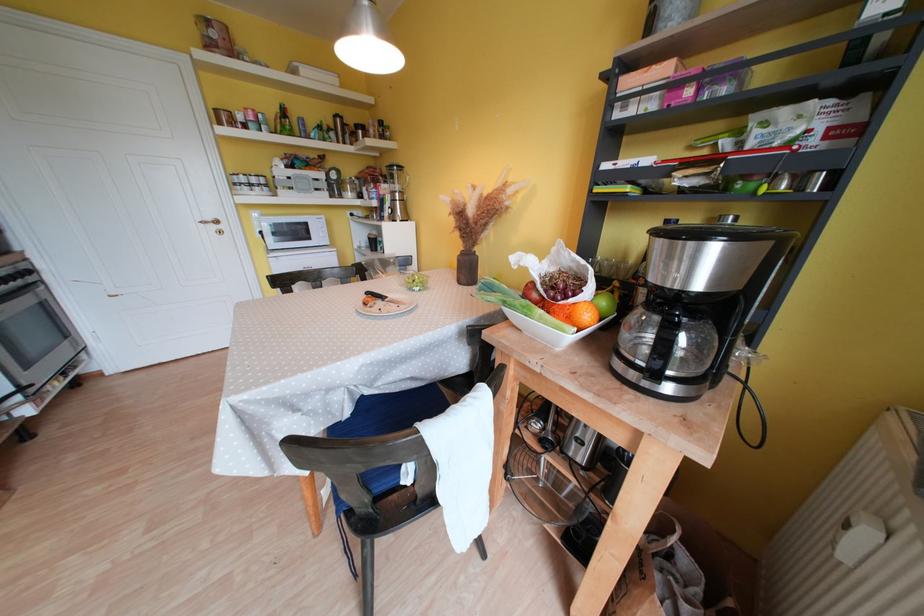
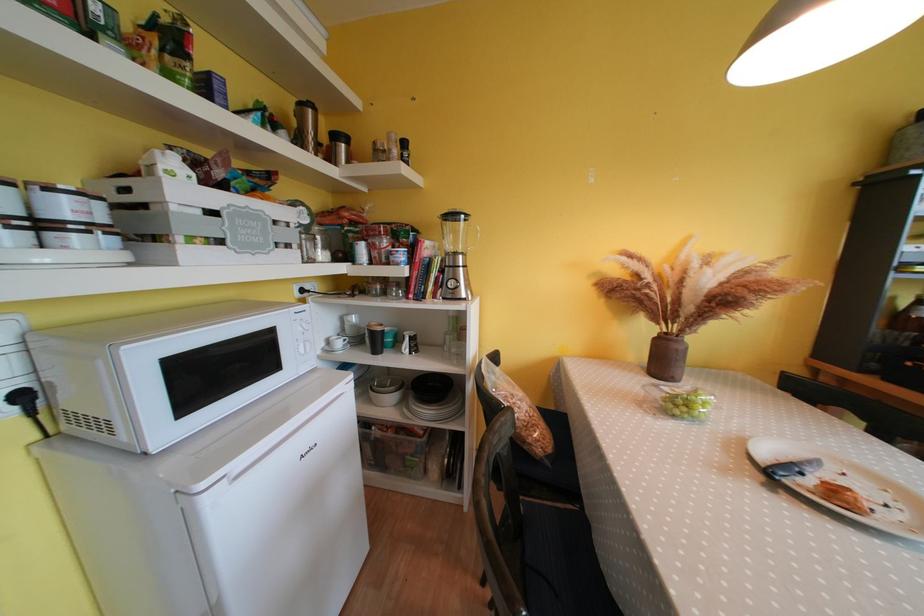
Where in the second image is the point corresponding to (370,248) from the first image?

(345, 347)